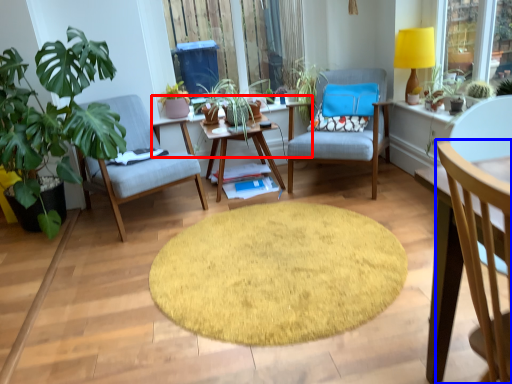
Question: Which of the following is the farthest to the observer, table (highlighted by a red box) or chair (highlighted by a blue box)?

Choices:
 (A) table
 (B) chair

Answer: (A)